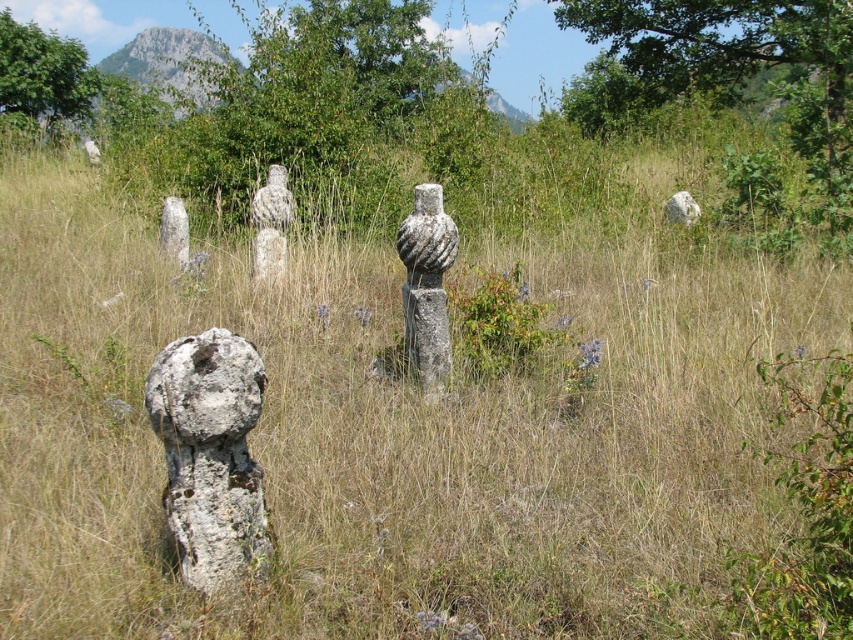
Question: Which of the following is the closest to the observer?

Choices:
 (A) weathered stone sculpture at center-left
 (B) white rough stone at upper right

Answer: (A)

Question: Which point is closer to the camera taking this photo?

Choices:
 (A) (233, 545)
 (B) (679, 221)
 (C) (285, 179)

Answer: (A)

Question: Which of the following is the farthest from the observer?

Choices:
 (A) (440, 240)
 (B) (270, 193)

Answer: (B)

Question: Does rusty stone statue at center have a greater width compared to white stone statue at center?

Choices:
 (A) yes
 (B) no

Answer: (A)

Question: Can you confirm if weathered stone sculpture at center-left is smaller than gray stone sculpture at center?

Choices:
 (A) yes
 (B) no

Answer: (A)

Question: Is speckled stone vase at center smaller than white stone statue at center?

Choices:
 (A) no
 (B) yes

Answer: (B)